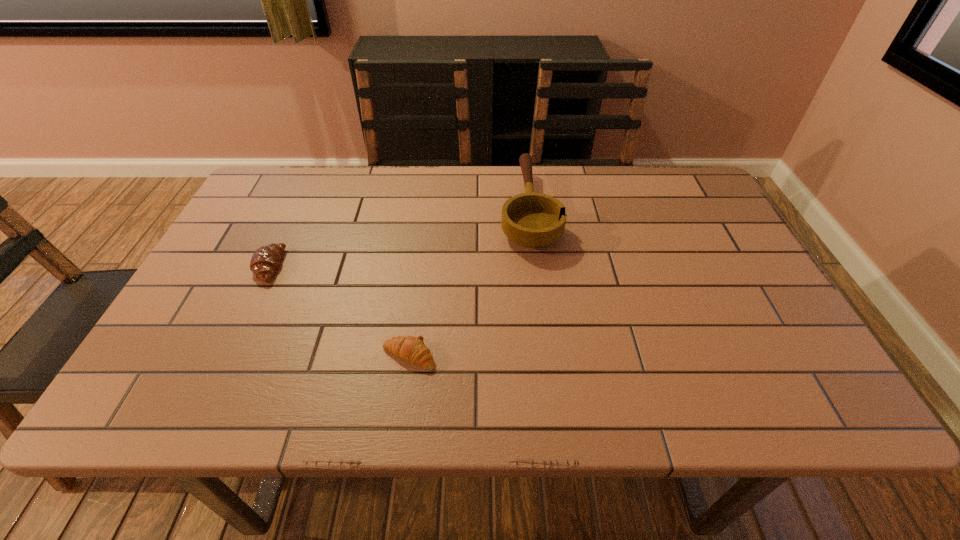
Locate an element on the screen. The height and width of the screenshot is (540, 960). free space between the nearest object and the leftmost object is located at coordinates (339, 311).

Identify the location of unoccupied area between the nearer crescent roll and the saucepan. The width and height of the screenshot is (960, 540). (468, 282).

The image size is (960, 540). Identify the location of free space that is in between the saucepan and the shortest object. (468, 282).

You are a GUI agent. You are given a task and a screenshot of the screen. Output one action in this format:
    pyautogui.click(x=<x>, y=<y>)
    Task: Click on the free space between the tallest object and the leftmost object
    The height and width of the screenshot is (540, 960).
    Given the screenshot: What is the action you would take?
    pyautogui.click(x=398, y=238)

Where is `vacant area between the second tallest object and the rightmost object`? This screenshot has height=540, width=960. vacant area between the second tallest object and the rightmost object is located at coordinates (398, 238).

Locate an element on the screen. The width and height of the screenshot is (960, 540). unoccupied area between the second shortest object and the shortest object is located at coordinates (339, 311).

At what (x,y) coordinates should I click in order to perform the action: click on the closest object to the saucepan. Please return your answer as a coordinate pair (x, y). Looking at the image, I should click on (412, 349).

Identify which object is the second closest to the farther crescent roll. Please provide its 2D coordinates. Your answer should be formatted as a tuple, i.e. [(x, y)], where the tuple contains the x and y coordinates of a point satisfying the conditions above.

[(533, 220)]

This screenshot has height=540, width=960. What are the coordinates of `free space that satisfies the following two spatial constraints: 1. on the front side of the second object from right to left; 2. on the right side of the taller crescent roll` in the screenshot? It's located at [226, 356].